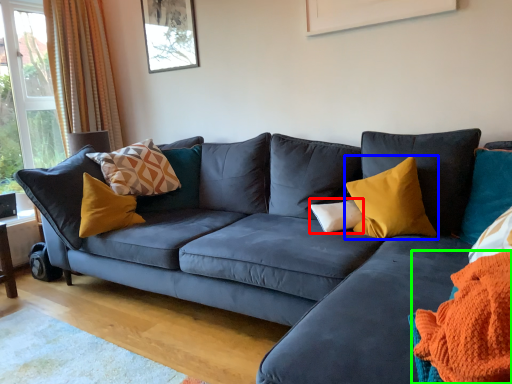
Question: Which is farther away from pillow (highlighted by a red box)? pillow (highlighted by a blue box) or blanket (highlighted by a green box)?

Choices:
 (A) pillow
 (B) blanket

Answer: (B)